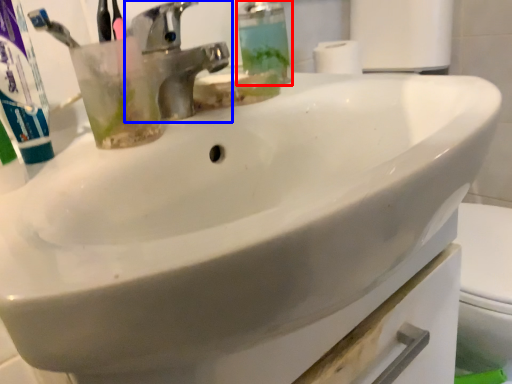
Question: Which of the following is the farthest to the observer, soap dispenser (highlighted by a red box) or tap (highlighted by a blue box)?

Choices:
 (A) soap dispenser
 (B) tap

Answer: (A)